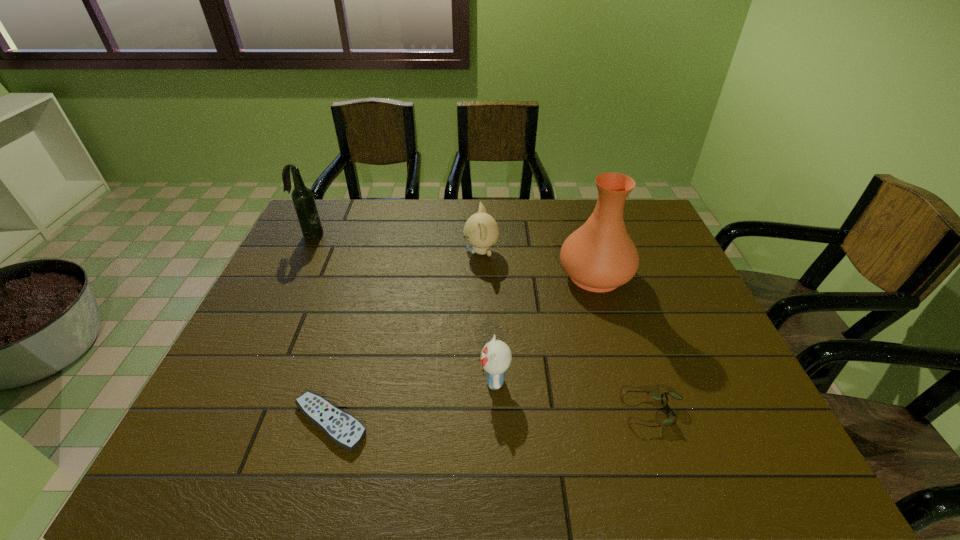
Where is `free point between the vase and the nearer kitten`? This screenshot has width=960, height=540. free point between the vase and the nearer kitten is located at coordinates (544, 327).

You are a GUI agent. You are given a task and a screenshot of the screen. Output one action in this format:
    pyautogui.click(x=<x>, y=<y>)
    Task: Click on the empty space that is in between the nearer kitten and the vase
    The width and height of the screenshot is (960, 540).
    Given the screenshot: What is the action you would take?
    pyautogui.click(x=544, y=327)

Image resolution: width=960 pixels, height=540 pixels. I want to click on vacant area that lies between the third shortest object and the tallest object, so click(x=544, y=327).

Locate which object ranks fifth in proximity to the fifth object from right to left. Please provide its 2D coordinates. Your answer should be formatted as a tuple, i.e. [(x, y)], where the tuple contains the x and y coordinates of a point satisfying the conditions above.

[(303, 199)]

You are a GUI agent. You are given a task and a screenshot of the screen. Output one action in this format:
    pyautogui.click(x=<x>, y=<y>)
    Task: Click on the object that stands as the second closest to the fifth shortest object
    
    Given the screenshot: What is the action you would take?
    pyautogui.click(x=342, y=428)

Identify the location of vacant area that satisfies the following two spatial constraints: 1. on the face of the farther kitten; 2. on the left side of the vase. The height and width of the screenshot is (540, 960). (481, 275).

Where is `vacant point that satisfies the following two spatial constraints: 1. on the face of the tallest object; 2. on the left side of the farther kitten`? vacant point that satisfies the following two spatial constraints: 1. on the face of the tallest object; 2. on the left side of the farther kitten is located at coordinates (481, 275).

This screenshot has height=540, width=960. In order to click on vacant space that satisfies the following two spatial constraints: 1. on the face of the tallest object; 2. on the right side of the farther kitten in this screenshot , I will do `click(481, 275)`.